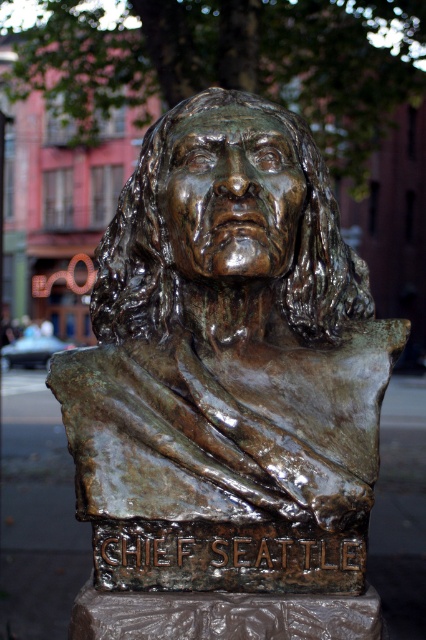
Question: Is the position of bronze statue at center more distant than that of bronze bust at center?

Choices:
 (A) no
 (B) yes

Answer: (A)

Question: Which point is closer to the camera?

Choices:
 (A) (66, 410)
 (B) (172, 172)

Answer: (A)

Question: Which of the following is the farthest from the observer?

Choices:
 (A) bronze statue at center
 (B) bronze bust at center

Answer: (B)

Question: Is bronze statue at center further to the viewer compared to bronze bust at center?

Choices:
 (A) no
 (B) yes

Answer: (A)

Question: Considering the relative positions of bronze statue at center and bronze bust at center in the image provided, where is bronze statue at center located with respect to bronze bust at center?

Choices:
 (A) left
 (B) right

Answer: (A)

Question: Among these objects, which one is nearest to the camera?

Choices:
 (A) bronze bust at center
 (B) bronze statue at center

Answer: (B)